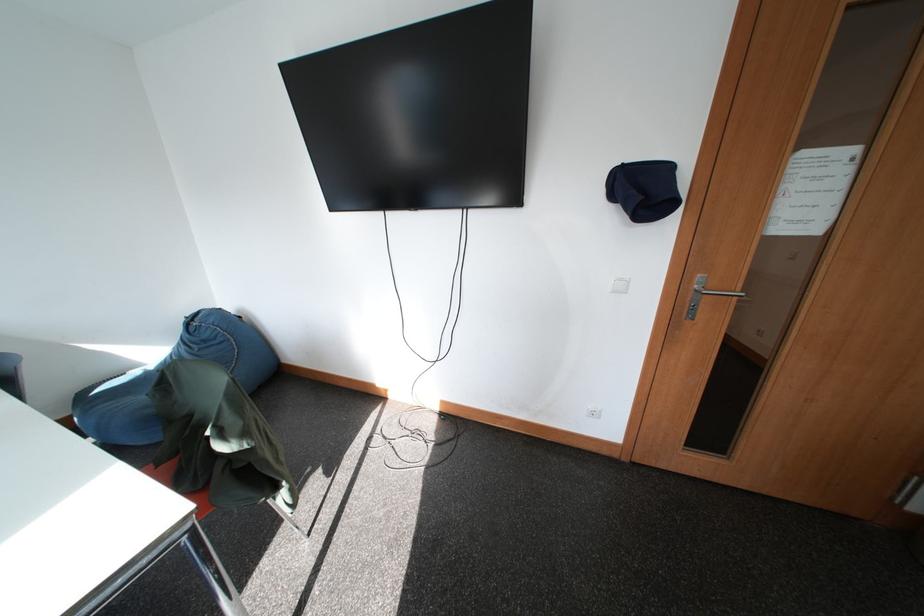
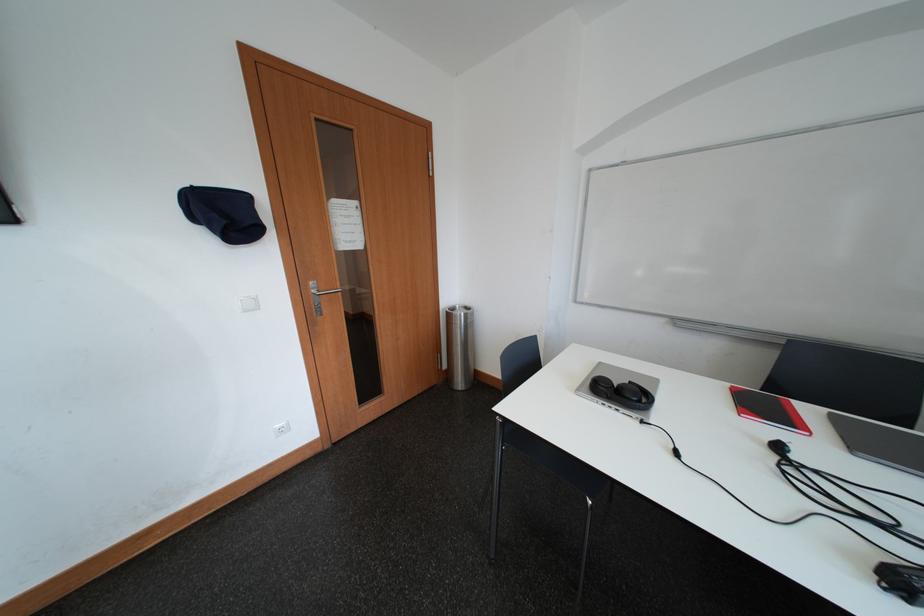
Question: The first image is from the beginning of the video and the second image is from the end. How did the camera likely rotate when shooting the video?

Choices:
 (A) Left
 (B) Right
 (C) Up
 (D) Down

Answer: (B)